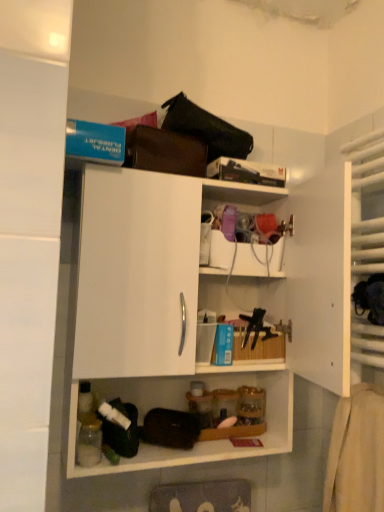
Question: Considering the relative positions of translucent plastic container at upper center, positioned as the second shelf in left-to-right order, and white matte cabinet at center, which is counted as the 1th shelf, starting from the left, in the image provided, is translucent plastic container at upper center, positioned as the second shelf in left-to-right order, to the left or to the right of white matte cabinet at center, which is counted as the 1th shelf, starting from the left,?

Choices:
 (A) right
 (B) left

Answer: (A)

Question: From a real-world perspective, is translucent plastic container at upper center, which is counted as the first shelf, starting from the right, above or below white matte cabinet at center, which is counted as the 2th shelf, starting from the right?

Choices:
 (A) below
 (B) above

Answer: (B)

Question: Is translucent plastic container at upper center, which is counted as the first shelf, starting from the right, bigger or smaller than white matte cabinet at center, which is counted as the 2th shelf, starting from the right?

Choices:
 (A) big
 (B) small

Answer: (B)

Question: Would you say white matte cabinet at center, which is counted as the 1th shelf, starting from the left, is to the left or to the right of translucent plastic container at upper center, which is counted as the first shelf, starting from the right, in the picture?

Choices:
 (A) left
 (B) right

Answer: (A)

Question: Does point (145, 216) appear closer or farther from the camera than point (220, 252)?

Choices:
 (A) farther
 (B) closer

Answer: (B)

Question: Which is correct: white matte cabinet at center, which is counted as the 1th shelf, starting from the left, is inside translucent plastic container at upper center, positioned as the second shelf in left-to-right order, or outside of it?

Choices:
 (A) inside
 (B) outside

Answer: (B)

Question: From the image's perspective, relative to translucent plastic container at upper center, which is counted as the first shelf, starting from the right, is white matte cabinet at center, which is counted as the 2th shelf, starting from the right, above or below?

Choices:
 (A) above
 (B) below

Answer: (B)